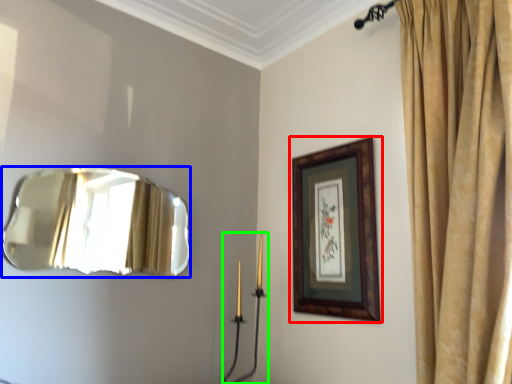
Question: Which object is positioned farthest from picture frame (highlighted by a red box)? Select from mirror (highlighted by a blue box) and candle holder (highlighted by a green box).

Choices:
 (A) mirror
 (B) candle holder

Answer: (A)